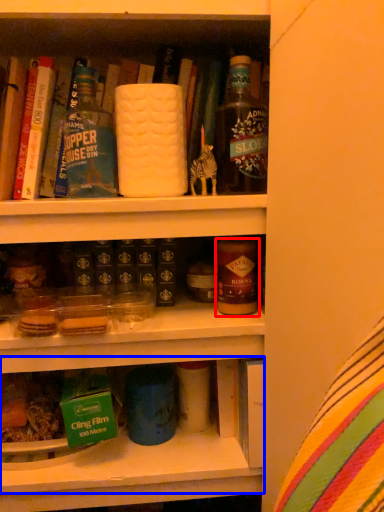
Question: Which of the following is the farthest to the observer, beverage (highlighted by a red box) or shelf (highlighted by a blue box)?

Choices:
 (A) beverage
 (B) shelf

Answer: (A)